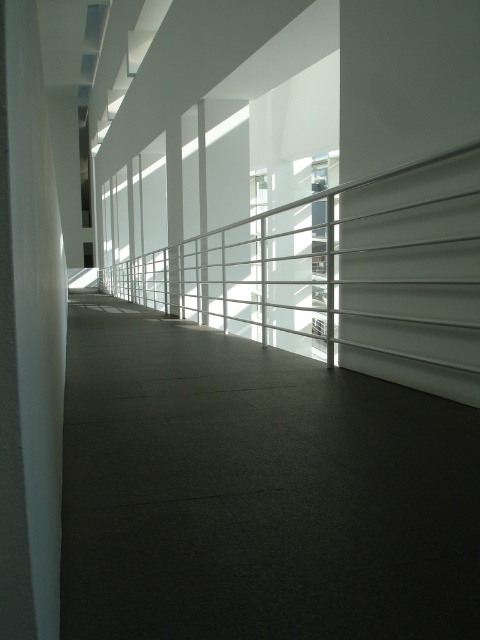
Between white metallic rail at center and white smooth pillar at left, which one has less height?

white smooth pillar at left is shorter.

Can you confirm if white metallic rail at center is positioned to the left of white smooth pillar at left?

In fact, white metallic rail at center is to the right of white smooth pillar at left.

Who is more forward, (444, 166) or (25, 512)?

Point (25, 512) is more forward.

The width and height of the screenshot is (480, 640). Identify the location of white metallic rail at center. (336, 268).